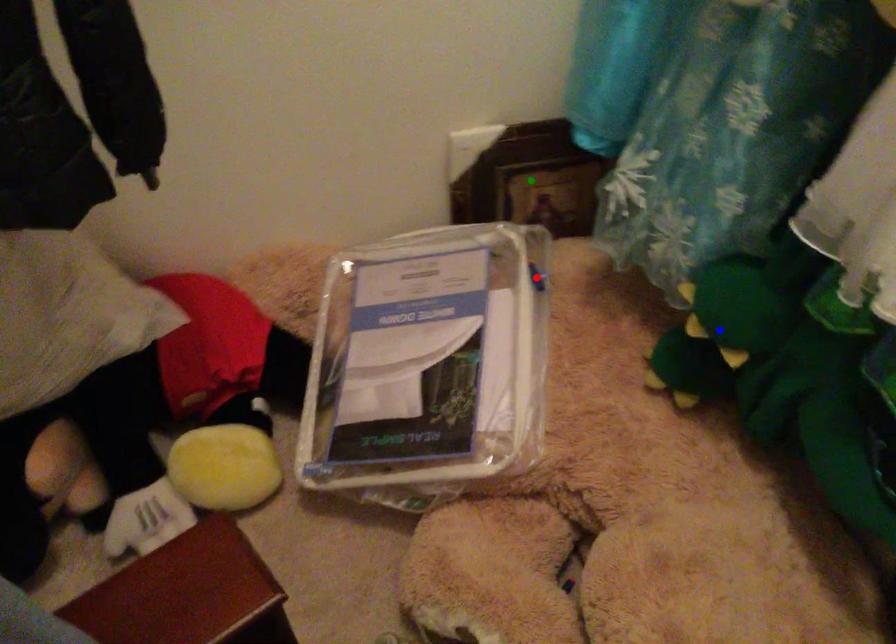
Order these from nearest to farthest:
- blue point
- green point
- red point

blue point < red point < green point